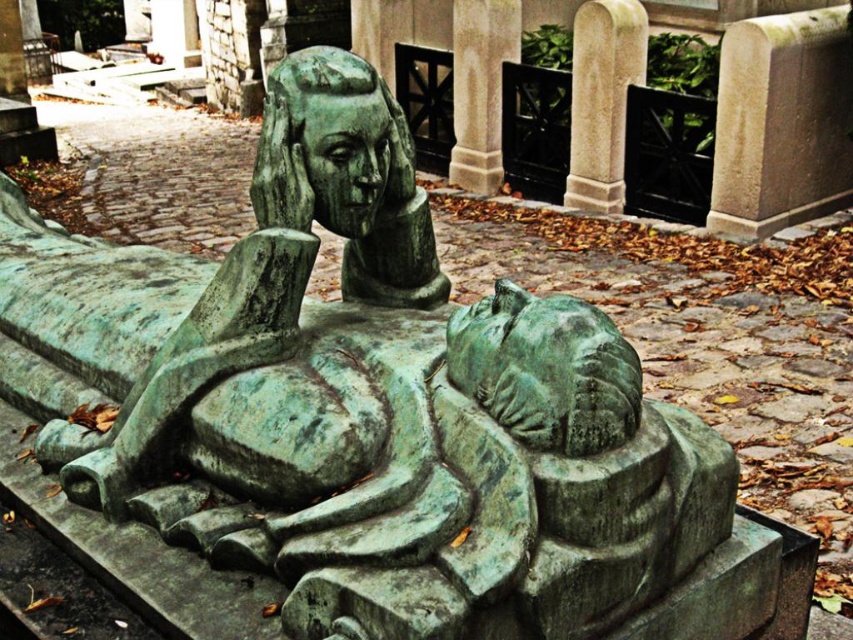
You are standing at the center of the cemetery and want to find the green patina bust at center. Which direction should you look to locate it?

The green patina bust at center is located at point (346, 176), so you should look towards the lower left direction from the center to find it.

You are standing in a cemetery and want to take a photo of the green patina bust at center. Your camera has a minimum focusing distance of 2 meters. Can you take a clear photo without moving closer?

The green patina bust at center is 2.35 meters away from camera, which is beyond the minimum focusing distance of 2 meters. Therefore, you can take a clear photo without moving closer.

You are an art student visiting the cemetery and want to sketch the sculpture. You have a small sketchbook that can only accommodate objects up to the size of the smooth stone pillar at center. Will the green patina bust at center fit in your sketchbook?

The green patina bust at center has a smaller size compared to the smooth stone pillar at center, so it will fit in the sketchbook designed for the pillar size.